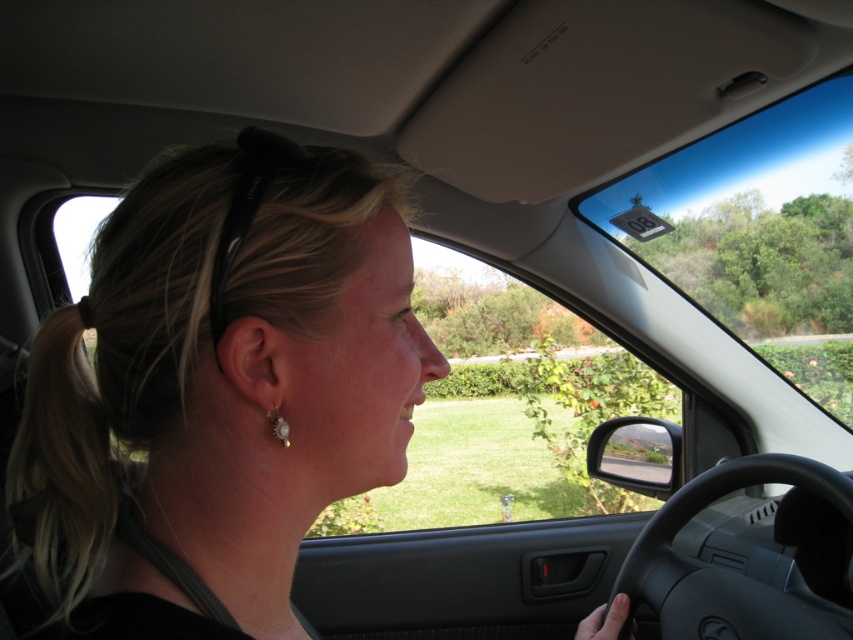
Question: Can you confirm if blonde hair at left is thinner than pearl earrings at ear?

Choices:
 (A) no
 (B) yes

Answer: (A)

Question: Which point is farther to the camera?

Choices:
 (A) (78, 385)
 (B) (683, 502)
 (C) (276, 419)
 (D) (194, 572)

Answer: (B)

Question: Where is blonde hair at center located in relation to blonde hair at left in the image?

Choices:
 (A) left
 (B) right

Answer: (B)

Question: Which point appears closest to the camera in this image?

Choices:
 (A) (198, 564)
 (B) (10, 490)

Answer: (A)

Question: Does blonde hair at center have a lesser width compared to blonde hair at left?

Choices:
 (A) no
 (B) yes

Answer: (A)

Question: Which object is positioned farthest from the blonde hair at center?

Choices:
 (A) black rubber steering wheel at lower right
 (B) blonde hair at left

Answer: (A)